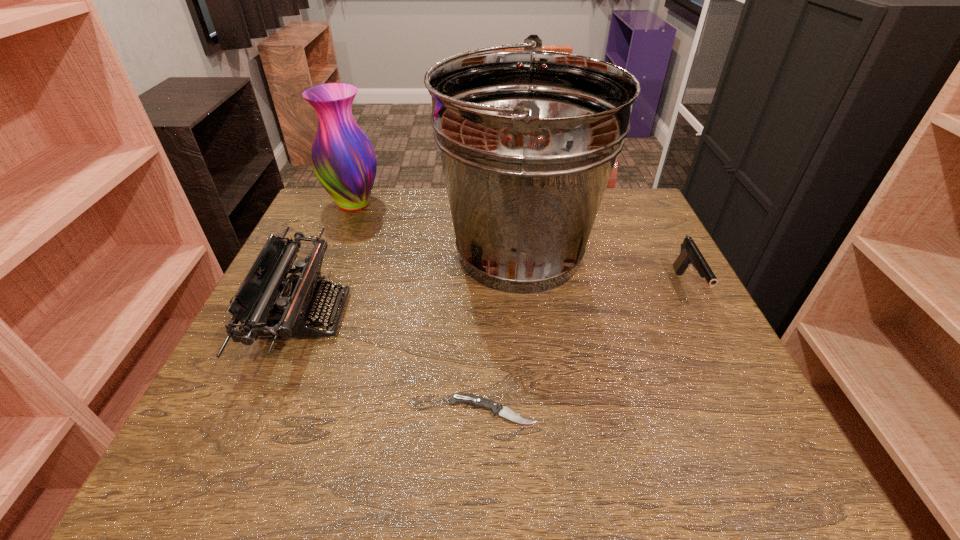
Locate an element on the screen. bucket is located at coordinates (528, 139).

Identify the location of the fourth shortest object. (343, 159).

Where is `typewriter`? typewriter is located at coordinates coord(300,297).

Image resolution: width=960 pixels, height=540 pixels. I want to click on the rightmost object, so click(690, 255).

Identify the location of the second shortest object. (690, 255).

Where is `pocketknife`? Image resolution: width=960 pixels, height=540 pixels. pocketknife is located at coordinates (477, 401).

The width and height of the screenshot is (960, 540). I want to click on the shortest object, so click(x=477, y=401).

You are a GUI agent. You are given a task and a screenshot of the screen. Output one action in this format:
    pyautogui.click(x=<x>, y=<y>)
    Task: Click on the vacant point located 0.100m on the left of the tallest object
    The image size is (960, 540).
    Given the screenshot: What is the action you would take?
    pyautogui.click(x=396, y=252)

Find the location of `vacant point located 0.370m on the right of the vase`. vacant point located 0.370m on the right of the vase is located at coordinates (516, 204).

Identify the location of vacant space located on the typing side of the third shortest object. (482, 315).